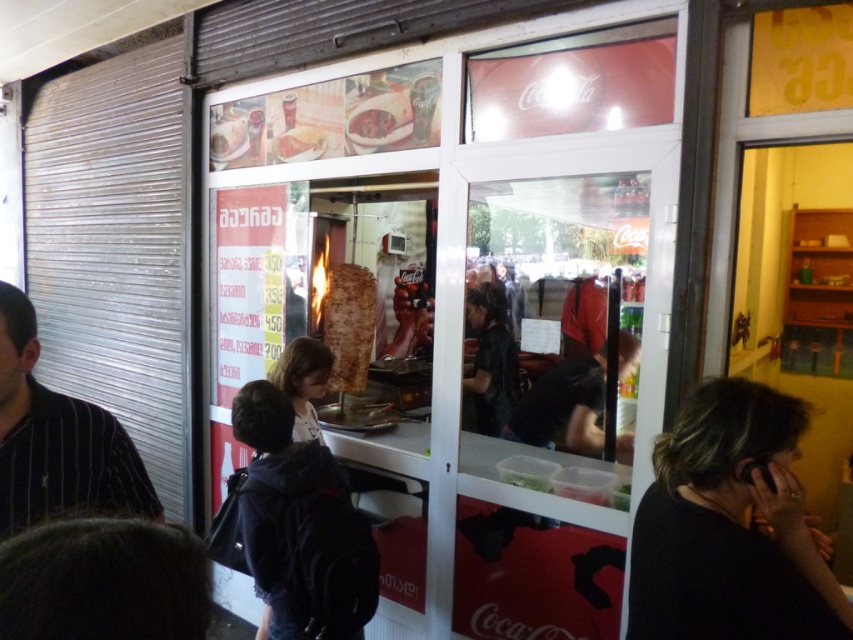
Between black striped shirt at left and dark brown hair at center, which one appears on the left side from the viewer's perspective?

black striped shirt at left is more to the left.

Can you confirm if black striped shirt at left is positioned above dark brown hair at center?

Yes, black striped shirt at left is above dark brown hair at center.

At what (x,y) coordinates should I click in order to perform the action: click on black striped shirt at left. Please return your answer as a coordinate pair (x, y). Looking at the image, I should click on (57, 440).

Where is `black striped shirt at left`? black striped shirt at left is located at coordinates (57, 440).

Does black striped shirt at left have a greater width compared to brown crispy doner at center?

Indeed, black striped shirt at left has a greater width compared to brown crispy doner at center.

Is black striped shirt at left to the left of brown crispy doner at center from the viewer's perspective?

Correct, you'll find black striped shirt at left to the left of brown crispy doner at center.

Which is in front, point (55, 442) or point (363, 324)?

Positioned in front is point (55, 442).

In order to click on black striped shirt at left in this screenshot , I will do `click(57, 440)`.

Who is positioned more to the left, dark brown hair at lower left or black striped shirt at left?

black striped shirt at left is more to the left.

Which of these two, dark brown hair at lower left or black striped shirt at left, stands taller?

Standing taller between the two is black striped shirt at left.

Between point (204, 554) and point (100, 444), which one is positioned behind?

The point (100, 444) is behind.

The image size is (853, 640). I want to click on dark brown hair at lower left, so click(x=103, y=580).